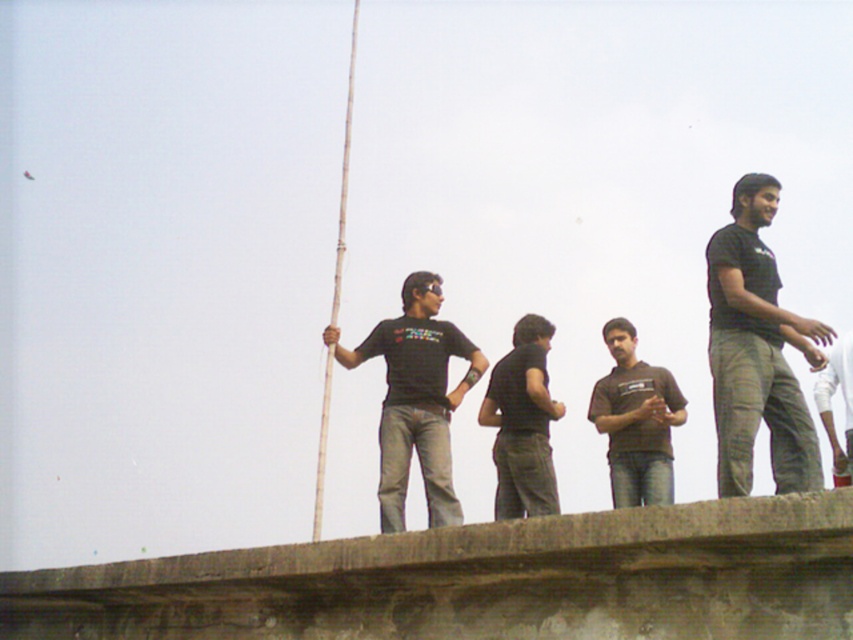
You are a photographer trying to capture a photo of the smooth bamboo pole at center without any people in the frame. Since the brown matte shirt at center is blocking the view, can you move the pole to the left to avoid the person?

The brown matte shirt at center is positioned under the smooth bamboo pole at center, so moving the pole to the left might not help as the person is directly below it. You might need to adjust your angle or ask the person to step aside.